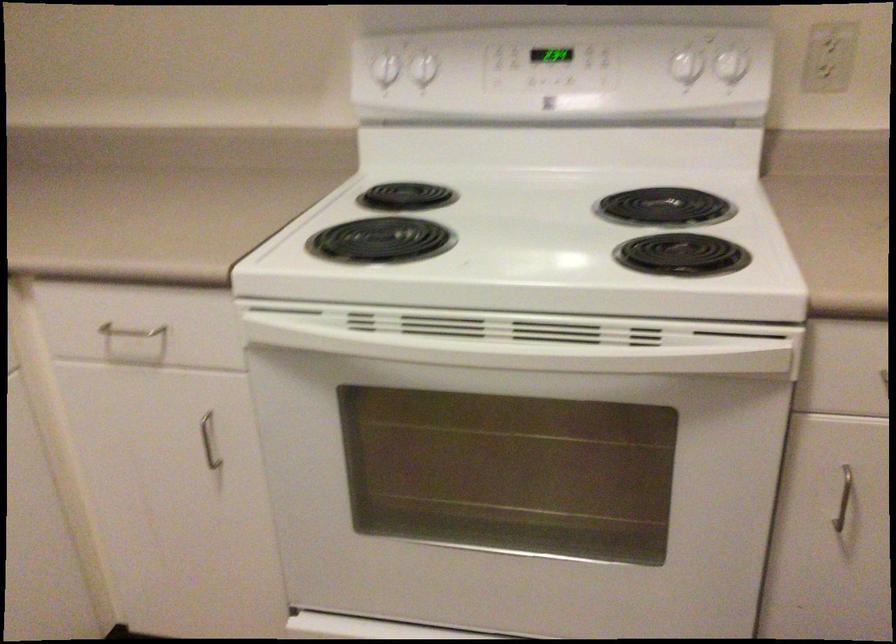
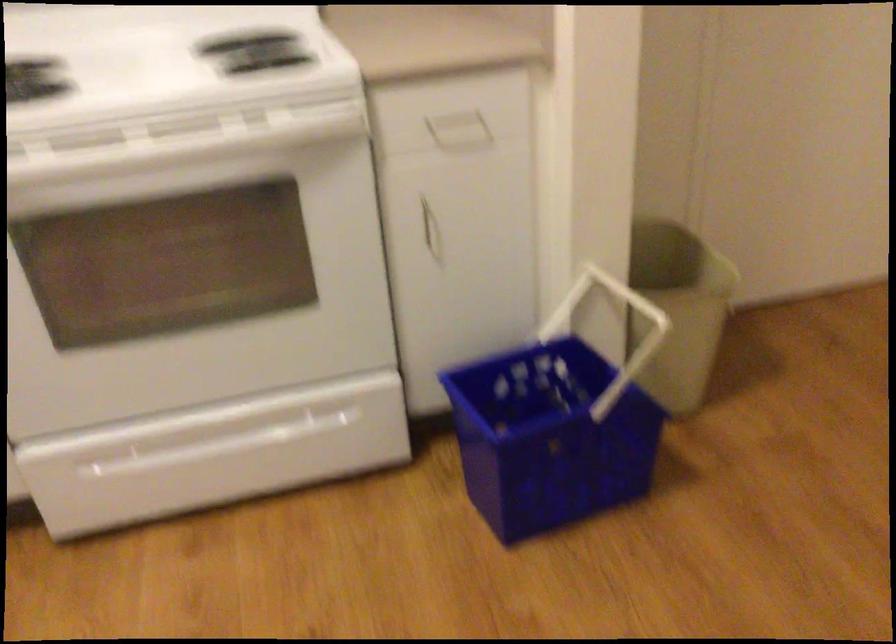
The point at (532, 348) is marked in the first image. Where is the corresponding point in the second image?

(175, 143)